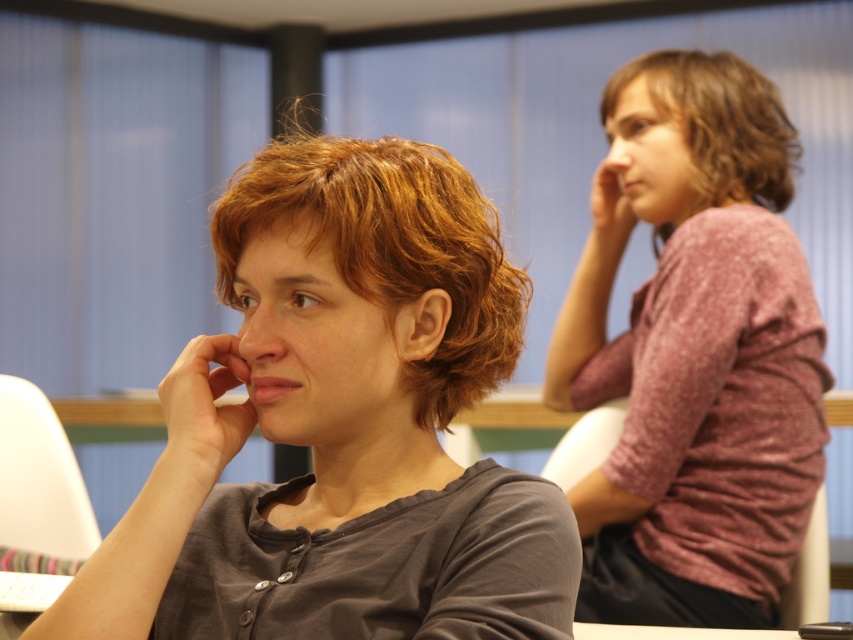
Is shiny brown hair at center bigger than matte skin nose at center?

Yes.

Does shiny brown hair at center appear on the left side of matte skin nose at center?

No, shiny brown hair at center is not to the left of matte skin nose at center.

The image size is (853, 640). What do you see at coordinates (390, 248) in the screenshot?
I see `shiny brown hair at center` at bounding box center [390, 248].

At what (x,y) coordinates should I click in order to perform the action: click on shiny brown hair at center. Please return your answer as a coordinate pair (x, y). This screenshot has width=853, height=640. Looking at the image, I should click on (390, 248).

Which is behind, point (389, 285) or point (715, 166)?

The point (715, 166) is behind.

Does dark gray matte shirt at center have a lesser height compared to brown curly hair at upper right?

No, dark gray matte shirt at center is not shorter than brown curly hair at upper right.

Is point (264, 244) more distant than point (746, 97)?

No.

The image size is (853, 640). Find the location of `dark gray matte shirt at center`. dark gray matte shirt at center is located at coordinates pyautogui.click(x=350, y=429).

Does matte skin hand at upper right have a smaller size compared to matte skin ear at center?

No, matte skin hand at upper right is not smaller than matte skin ear at center.

Between point (622, 205) and point (445, 292), which one is positioned behind?

The point (622, 205) is more distant.

Locate an element on the screen. This screenshot has width=853, height=640. matte skin hand at upper right is located at coordinates (611, 204).